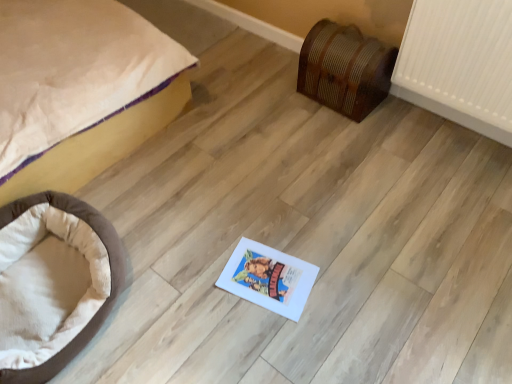
Question: From the image's perspective, is beige fabric bed at left above wooden chest at right?

Choices:
 (A) no
 (B) yes

Answer: (B)

Question: Does beige fabric bed at left come behind wooden chest at right?

Choices:
 (A) yes
 (B) no

Answer: (B)

Question: Is beige fabric bed at left oriented towards wooden chest at right?

Choices:
 (A) yes
 (B) no

Answer: (B)

Question: Can you confirm if beige fabric bed at left is positioned to the left of wooden chest at right?

Choices:
 (A) no
 (B) yes

Answer: (B)

Question: Is beige fabric bed at left oriented away from wooden chest at right?

Choices:
 (A) yes
 (B) no

Answer: (B)

Question: From a real-world perspective, is wooden chest at right physically located above or below brown plush dog bed at lower left?

Choices:
 (A) below
 (B) above

Answer: (B)

Question: From the image's perspective, relative to brown plush dog bed at lower left, is wooden chest at right above or below?

Choices:
 (A) below
 (B) above

Answer: (B)

Question: Is point click(343, 56) positioned closer to the camera than point click(116, 294)?

Choices:
 (A) closer
 (B) farther

Answer: (B)

Question: Considering the positions of wooden chest at right and brown plush dog bed at lower left in the image, is wooden chest at right taller or shorter than brown plush dog bed at lower left?

Choices:
 (A) tall
 (B) short

Answer: (A)

Question: In terms of width, does brown plush dog bed at lower left look wider or thinner when compared to wooden chest at right?

Choices:
 (A) thin
 (B) wide

Answer: (B)

Question: Is brown plush dog bed at lower left in front of or behind wooden chest at right in the image?

Choices:
 (A) front
 (B) behind

Answer: (A)

Question: From the image's perspective, is brown plush dog bed at lower left above or below wooden chest at right?

Choices:
 (A) above
 (B) below

Answer: (B)

Question: Is brown plush dog bed at lower left to the left or to the right of wooden chest at right in the image?

Choices:
 (A) right
 (B) left

Answer: (B)

Question: Choose the correct answer: Is beige fabric bed at left inside wooden chest at right or outside it?

Choices:
 (A) outside
 (B) inside

Answer: (A)

Question: Is point (74, 44) positioned closer to the camera than point (371, 69)?

Choices:
 (A) closer
 (B) farther

Answer: (A)